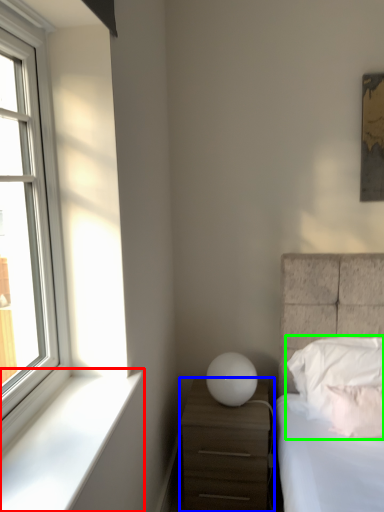
Question: Which object is the farthest from window sill (highlighted by a red box)? Choose among these: nightstand (highlighted by a blue box) or pillow (highlighted by a green box).

Choices:
 (A) nightstand
 (B) pillow

Answer: (B)